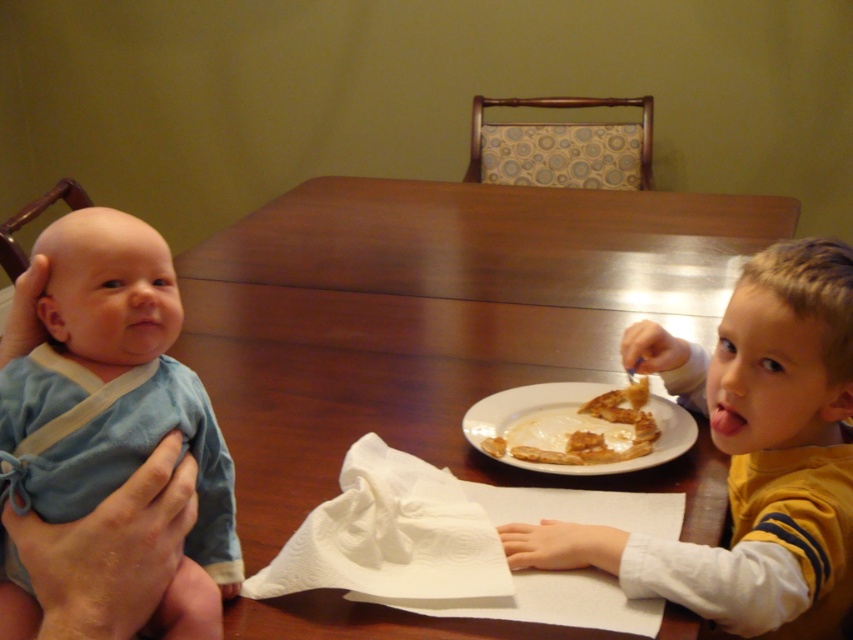
You are a photographer trying to capture a candid shot of the blue cotton baby at left and the golden brown crispy pastry at center. If you want to ensure both subjects are in focus, which one should you adjust your camera focus on first considering their sizes?

The blue cotton baby at left is smaller than the golden brown crispy pastry at center, so you should focus on the larger subject first as it requires more precise focus adjustment.

You are a parent trying to hand a golden brown crispy pastry at center to your child. The child is wearing a yellow striped shirt at right. Where should you aim to place the pastry so the child can easily reach it?

The golden brown crispy pastry at center should be placed above the yellow striped shirt at right since the shirt is located below the pastry, making it within the child s reach.

You are a photographer standing at the dining table. You want to take a closeup photo of the yellow striped shirt at right. The camera you are using has a minimum focusing distance of 30 inches. Can you take the photo without moving the subject?

The distance of yellow striped shirt at right from camera is 31.82 inches, which is greater than the camera minimum focusing distance of 30 inches. Therefore, you can take the closeup photo without moving the subject.